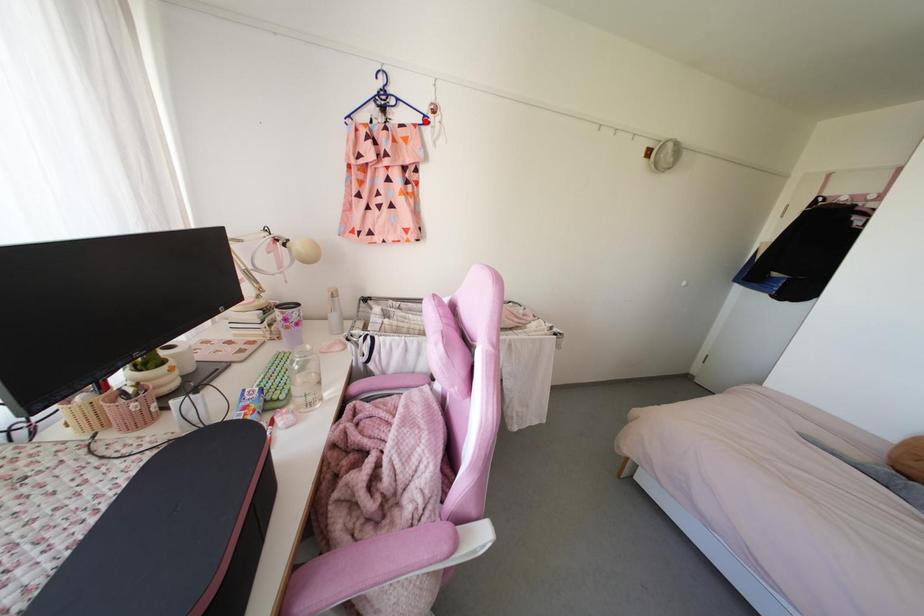
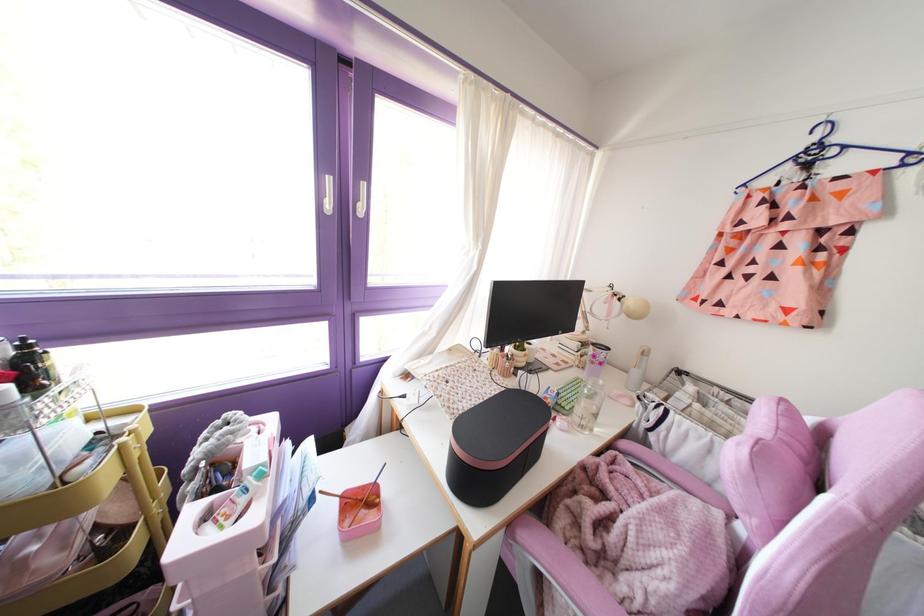
Where in the second image is the point corresponding to the highlighted location from the first image?

(913, 159)